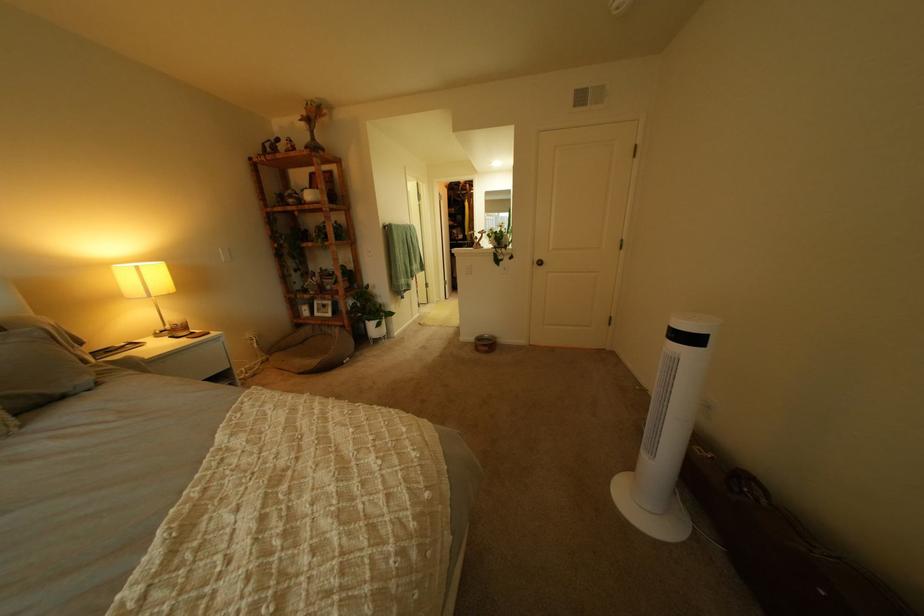
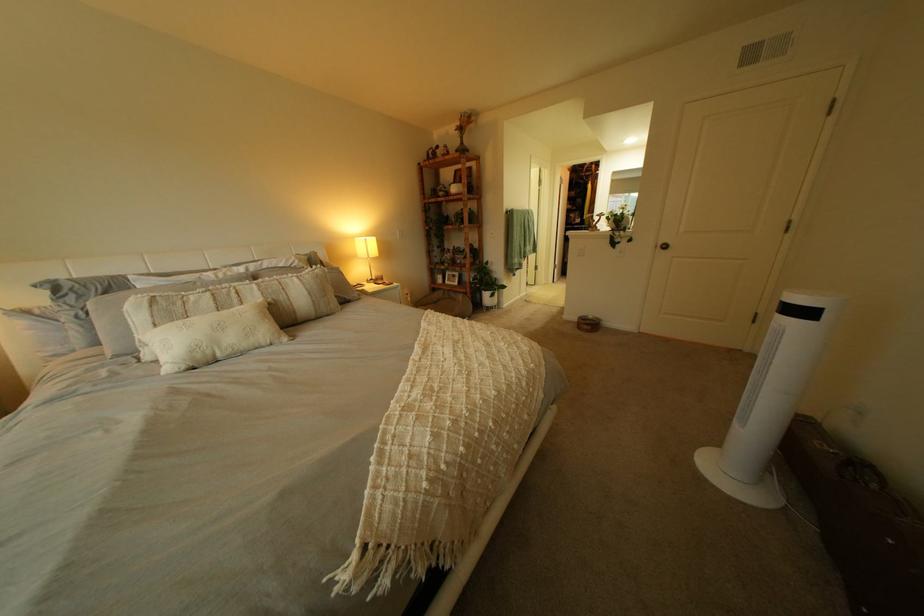
Question: The first image is from the beginning of the video and the second image is from the end. How did the camera likely rotate when shooting the video?

Choices:
 (A) Left
 (B) Right
 (C) Up
 (D) Down

Answer: (A)